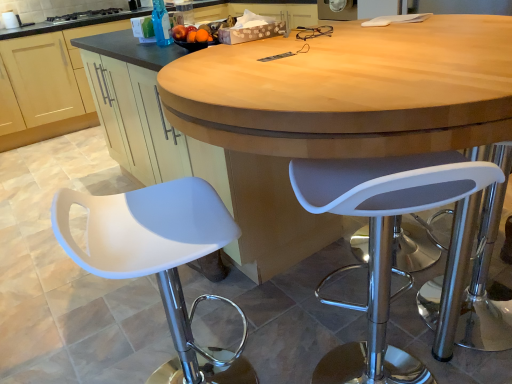
At what (x,y) coordinates should I click in order to perform the action: click on vacant area that is situated to the right of white matte stool at left, positioned as the first chair in left-to-right order. Please return your answer as a coordinate pair (x, y). The width and height of the screenshot is (512, 384). Looking at the image, I should click on (285, 345).